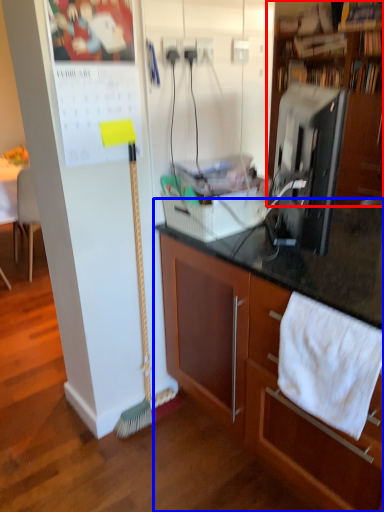
Question: Which object is further to the camera taking this photo, cabinetry (highlighted by a red box) or cabinetry (highlighted by a blue box)?

Choices:
 (A) cabinetry
 (B) cabinetry

Answer: (A)